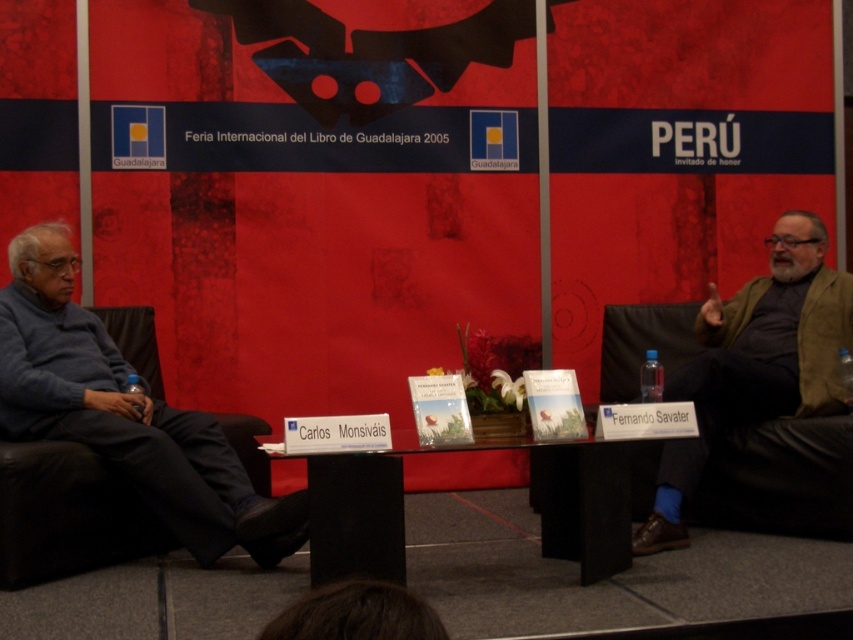
Question: Which point appears closest to the camera in this image?

Choices:
 (A) (15, 292)
 (B) (767, 417)

Answer: (A)

Question: Considering the real-world distances, which object is farthest from the transparent glass table at center?

Choices:
 (A) blue sweater at left
 (B) brown suede jacket at right

Answer: (A)

Question: Which object is farther from the camera taking this photo?

Choices:
 (A) transparent glass table at center
 (B) blue sweater at left
 (C) brown suede jacket at right

Answer: (C)

Question: Is blue sweater at left thinner than transparent glass table at center?

Choices:
 (A) no
 (B) yes

Answer: (B)

Question: Does blue sweater at left appear on the left side of brown suede jacket at right?

Choices:
 (A) no
 (B) yes

Answer: (B)

Question: Observing the image, what is the correct spatial positioning of blue sweater at left in reference to brown suede jacket at right?

Choices:
 (A) left
 (B) right

Answer: (A)